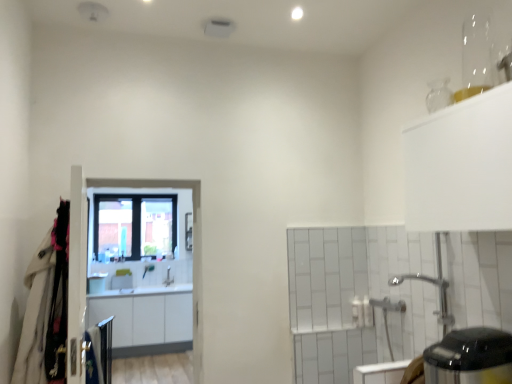
This screenshot has height=384, width=512. What are the coordinates of `clear glass window at center` in the screenshot? It's located at (134, 225).

Locate an element on the screen. This screenshot has height=384, width=512. black glossy electric kettle at lower right is located at coordinates (470, 357).

Image resolution: width=512 pixels, height=384 pixels. Identify the location of silver metallic faucet at center. (168, 278).

Describe the element at coordinates (193, 240) in the screenshot. This screenshot has height=384, width=512. I see `white glossy screen door at center` at that location.

Find the location of a particular element. This screenshot has height=384, width=512. clear glass window at center is located at coordinates (134, 225).

Between white glossy screen door at center and clear glass window at center, which one has larger size?

Bigger between the two is clear glass window at center.

Is white glossy screen door at center situated inside clear glass window at center or outside?

white glossy screen door at center cannot be found inside clear glass window at center.

From the picture: Between white glossy screen door at center and clear glass window at center, which one appears on the right side from the viewer's perspective?

white glossy screen door at center.

Considering the positions of points (123, 180) and (129, 253), is point (123, 180) closer to camera compared to point (129, 253)?

Yes, it is in front of point (129, 253).

Identify the location of faucet that appears below the clear glass window at center (from the image's perspective). The height and width of the screenshot is (384, 512). (168, 278).

From the picture: Would you consider silver metallic faucet at center to be distant from clear glass window at center?

No, silver metallic faucet at center is in close proximity to clear glass window at center.

Is silver metallic faucet at center located outside clear glass window at center?

Indeed, silver metallic faucet at center is completely outside clear glass window at center.

How much distance is there between silver metallic faucet at center and clear glass window at center?

17.47 inches.

Is black glossy electric kettle at lower right far from clear glass window at center?

Yes, black glossy electric kettle at lower right is far from clear glass window at center.

Can you tell me how much black glossy electric kettle at lower right and clear glass window at center differ in facing direction?

The facing directions of black glossy electric kettle at lower right and clear glass window at center are 91.3 degrees apart.

Do you think black glossy electric kettle at lower right is within clear glass window at center, or outside of it?

black glossy electric kettle at lower right exists outside the volume of clear glass window at center.

Considering the sizes of objects black glossy electric kettle at lower right and clear glass window at center in the image provided, who is thinner, black glossy electric kettle at lower right or clear glass window at center?

With smaller width is clear glass window at center.

Which of these two, silver metallic faucet at center or white glossy cabinets at center, is smaller?

Smaller between the two is silver metallic faucet at center.

Can you confirm if silver metallic faucet at center is thinner than white glossy cabinets at center?

Correct, the width of silver metallic faucet at center is less than that of white glossy cabinets at center.

Which is behind, point (170, 283) or point (113, 304)?

The point (170, 283) is farther from the camera.

In terms of height, does black glossy electric kettle at lower right look taller or shorter compared to white glossy screen door at center?

Considering their sizes, black glossy electric kettle at lower right has less height than white glossy screen door at center.

Which object is positioned more to the left, black glossy electric kettle at lower right or white glossy screen door at center?

From the viewer's perspective, white glossy screen door at center appears more on the left side.

Can you confirm if black glossy electric kettle at lower right is wider than white glossy screen door at center?

Yes.

Identify the location of window on the left of white glossy cabinets at center. The width and height of the screenshot is (512, 384). (134, 225).

Measure the distance from white glossy cabinets at center to clear glass window at center.

white glossy cabinets at center is 18.14 inches from clear glass window at center.

Which is more to the right, white glossy cabinets at center or clear glass window at center?

From the viewer's perspective, white glossy cabinets at center appears more on the right side.

Who is more distant, white glossy cabinets at center or white fabric coat at left?

white glossy cabinets at center is further away from the camera.

From the image's perspective, between white glossy cabinets at center and white fabric coat at left, who is located below?

white glossy cabinets at center is shown below in the image.

Which of these two, white glossy cabinets at center or white fabric coat at left, stands taller?

With more height is white glossy cabinets at center.

In the scene shown: From a real-world perspective, is white glossy cabinets at center positioned under white fabric coat at left based on gravity?

Correct, in the physical world, white glossy cabinets at center is lower than white fabric coat at left.

Where is `window lying below the white glossy screen door at center (from the image's perspective)`? window lying below the white glossy screen door at center (from the image's perspective) is located at coordinates (134, 225).

What are the coordinates of `window behind the silver metallic faucet at center` in the screenshot? It's located at (134, 225).

Based on their spatial positions, is white glossy cabinets at center or white glossy screen door at center closer to white fabric coat at left?

Based on the image, white glossy screen door at center appears to be nearer to white fabric coat at left.

Consider the image. Based on their spatial positions, is silver metallic faucet at center or white glossy cabinets at center further from white glossy screen door at center?

silver metallic faucet at center.

Estimate the real-world distances between objects in this image. Which object is closer to silver metallic faucet at center, white glossy cabinets at center or clear glass window at center?

Based on the image, white glossy cabinets at center appears to be nearer to silver metallic faucet at center.

Considering their positions, is white glossy cabinets at center positioned further to clear glass window at center than silver metallic faucet at center?

white glossy cabinets at center.

When comparing their distances from white glossy cabinets at center, does silver metallic faucet at center or clear glass window at center seem further?

clear glass window at center lies further to white glossy cabinets at center than the other object.

Looking at the image, which one is located closer to white fabric coat at left, black glossy electric kettle at lower right or white glossy cabinets at center?

Among the two, white glossy cabinets at center is located nearer to white fabric coat at left.

From the image, which object appears to be nearer to silver metallic faucet at center, clear glass window at center or black glossy electric kettle at lower right?

clear glass window at center lies closer to silver metallic faucet at center than the other object.

When comparing their distances from silver metallic faucet at center, does white glossy cabinets at center or black glossy electric kettle at lower right seem closer?

white glossy cabinets at center lies closer to silver metallic faucet at center than the other object.

Find the location of `screen door positioned between black glossy electric kettle at lower right and silver metallic faucet at center from near to far`. screen door positioned between black glossy electric kettle at lower right and silver metallic faucet at center from near to far is located at coordinates (193, 240).

At what (x,y) coordinates should I click in order to perform the action: click on cabinetry positioned between white fabric coat at left and silver metallic faucet at center from near to far. Please return your answer as a coordinate pair (x, y). Looking at the image, I should click on (146, 320).

The width and height of the screenshot is (512, 384). I want to click on screen door between white fabric coat at left and clear glass window at center along the z-axis, so click(193, 240).

This screenshot has width=512, height=384. Identify the location of cabinetry between white glossy screen door at center and silver metallic faucet at center from front to back. (146, 320).